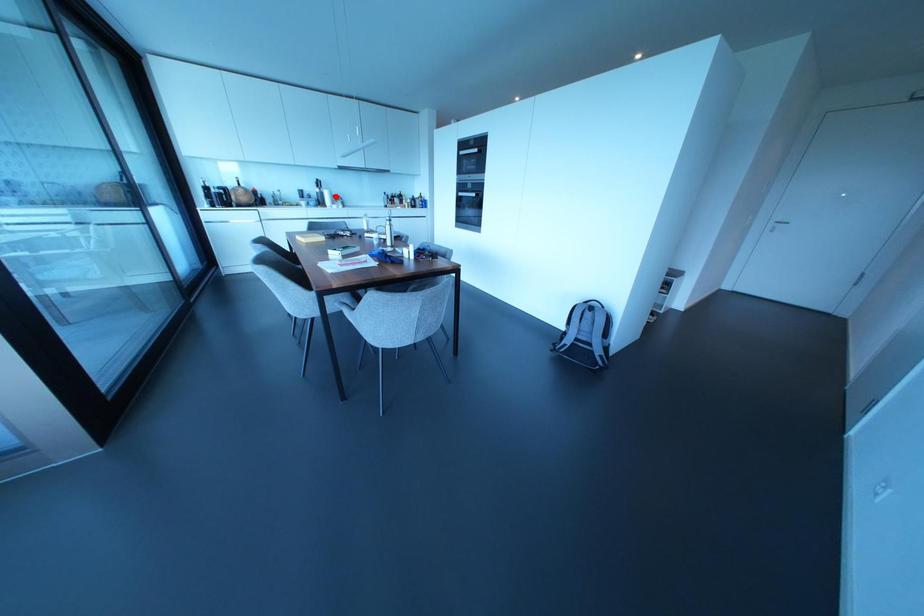
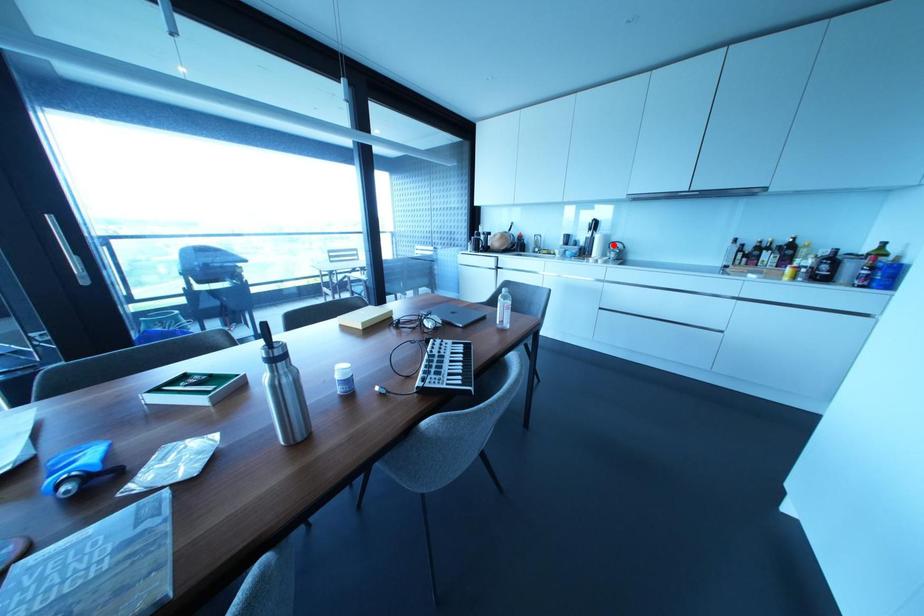
I am providing you with two images of the same scene from different viewpoints. A red point is marked on the first image and another point is marked on the second image. Does the point marked in image1 correspond to the same location as the one in image2?

Yes